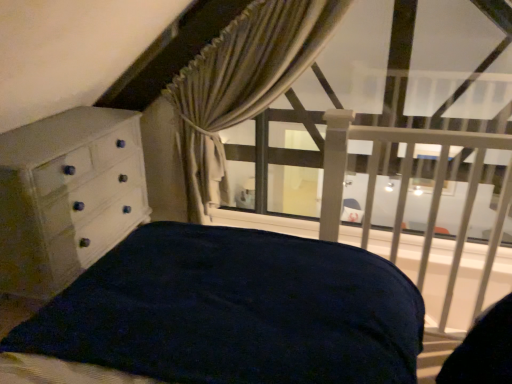
Question: Is beige textured curtain at upper center in front of or behind white painted wood chest of drawers at left in the image?

Choices:
 (A) front
 (B) behind

Answer: (B)

Question: Considering the relative positions of beige textured curtain at upper center and white painted wood chest of drawers at left in the image provided, is beige textured curtain at upper center to the left or to the right of white painted wood chest of drawers at left?

Choices:
 (A) left
 (B) right

Answer: (B)

Question: Which is farther from the beige textured curtain at upper center?

Choices:
 (A) white painted wood chest of drawers at left
 (B) white matte balustrade at upper right

Answer: (B)

Question: Based on their relative distances, which object is farther from the white matte balustrade at upper right?

Choices:
 (A) beige textured curtain at upper center
 (B) white painted wood chest of drawers at left

Answer: (B)